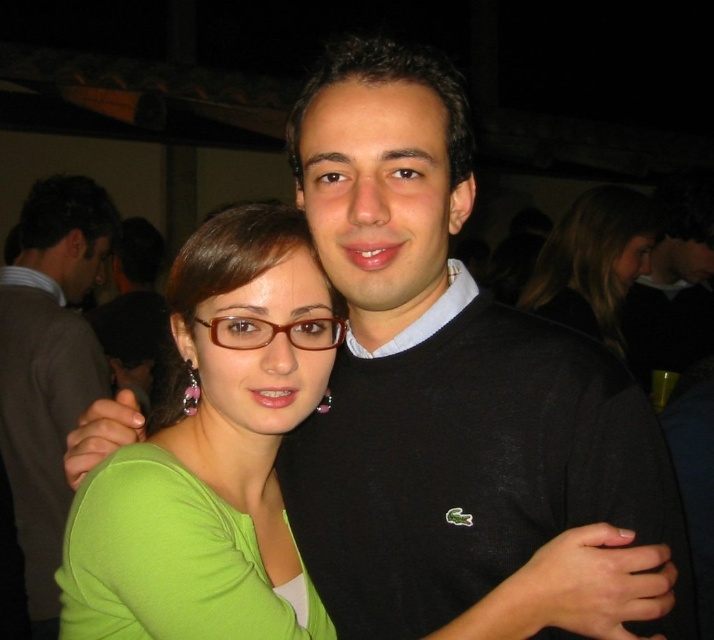
You are trying to decide which top to wear for an event. You have a green matte shirt at center and a black sweater at center. If you want to choose the wider one, which should you pick?

The green matte shirt at center is wider than the black sweater at center, so you should pick the green matte shirt at center.

You are trying to determine which object is closer to you in the scene. Based on the image, which is closer to you, the matte black sweater at center or the brown matte glasses at center?

The matte black sweater at center is closer to you because it is positioned over the brown matte glasses at center, indicating it is in front.